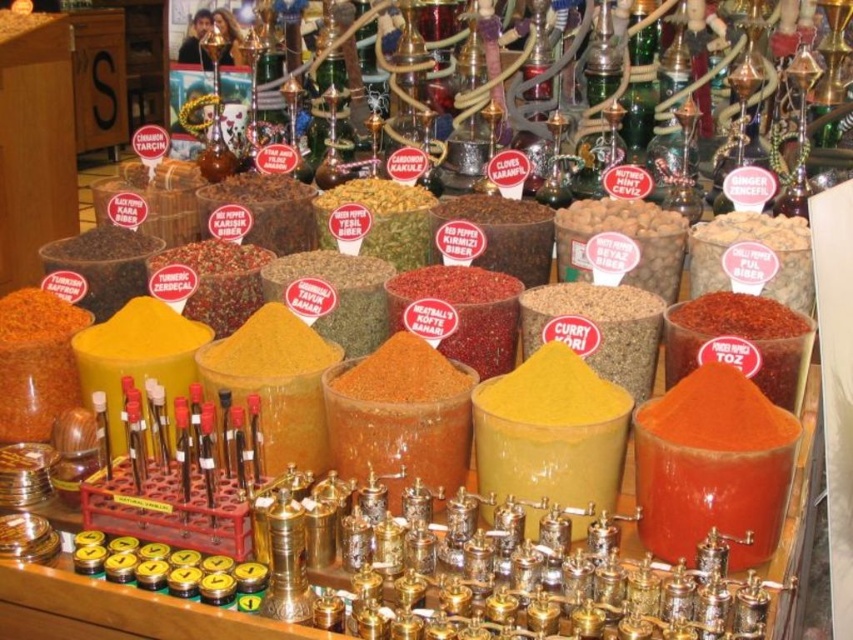
Question: Among these points, which one is farthest from the camera?

Choices:
 (A) (701, 266)
 (B) (239, 280)

Answer: (B)

Question: Is bright orange powder at center right smaller than dark red pepper at center?

Choices:
 (A) no
 (B) yes

Answer: (B)

Question: Among these objects, which one is nearest to the camera?

Choices:
 (A) brown granular curry at center
 (B) yellow powder at center
 (C) dark red pepper at center

Answer: (A)

Question: Which point is closer to the camera?

Choices:
 (A) (497, 237)
 (B) (784, 307)

Answer: (B)

Question: Is dark red pepper at center bigger than yellow powder at center?

Choices:
 (A) yes
 (B) no

Answer: (A)

Question: Does brown granular curry at center appear over dark red pepper at center?

Choices:
 (A) yes
 (B) no

Answer: (B)